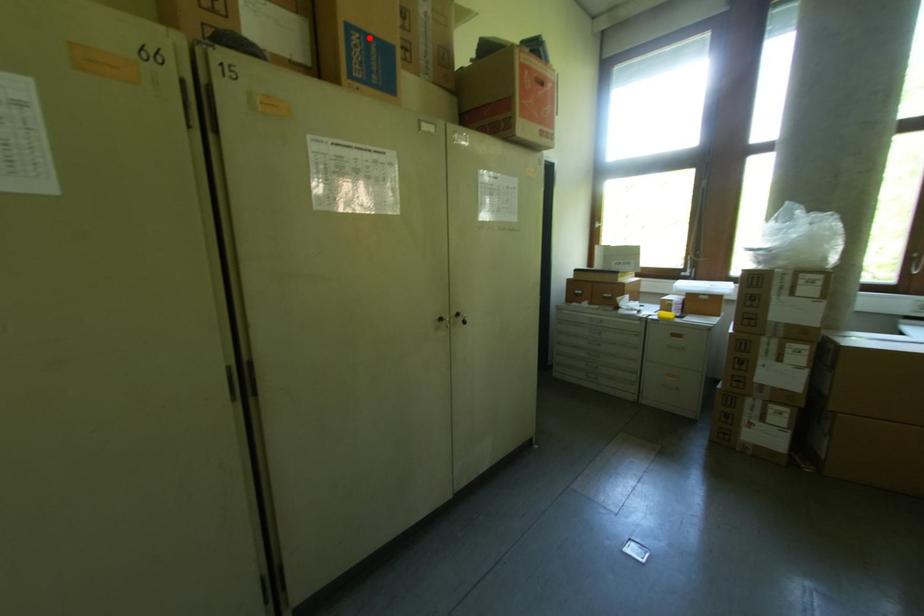
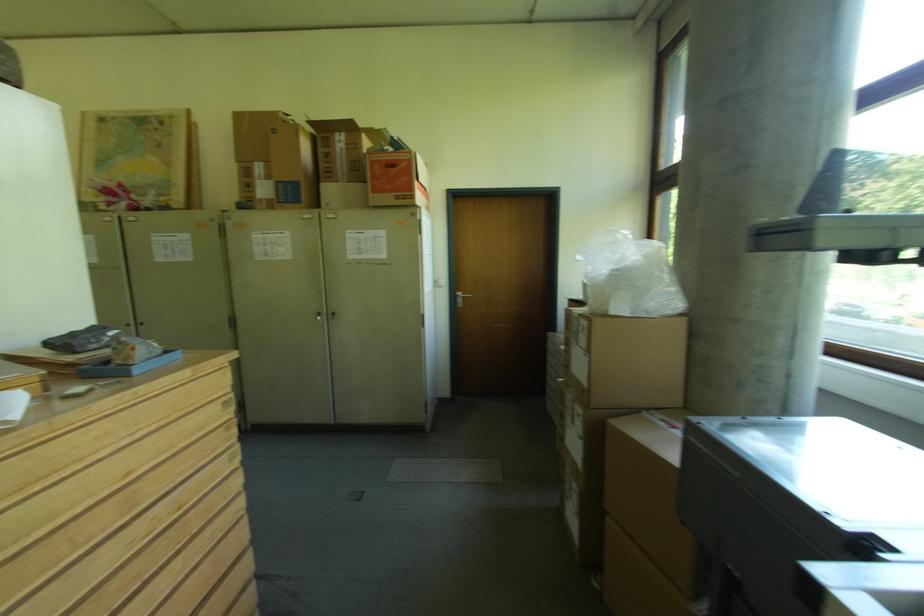
Where in the second image is the point corresponding to the highlighted location from the first image?

(287, 185)